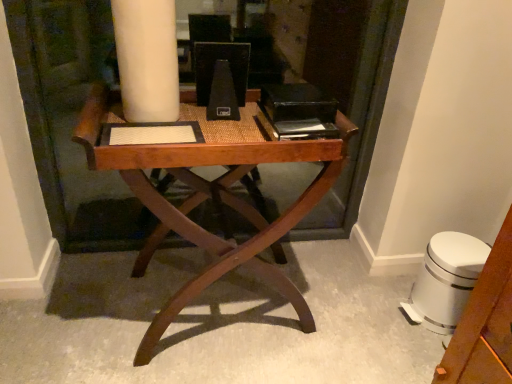
This screenshot has height=384, width=512. What are the coordinates of `vacant position to the left of wooden desk at center` in the screenshot? It's located at click(x=72, y=307).